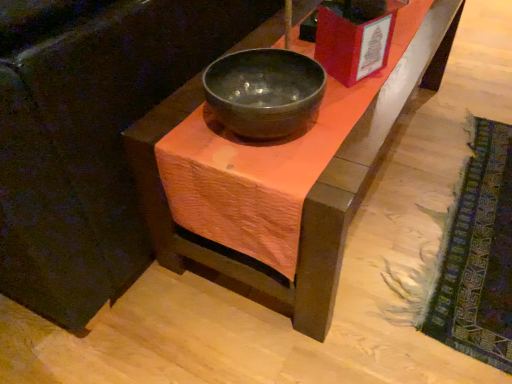
At what (x,y) coordinates should I click in order to perform the action: click on blank area to the left of textured woolen mat at lower right. Please return your answer as a coordinate pair (x, y). Looking at the image, I should click on (286, 307).